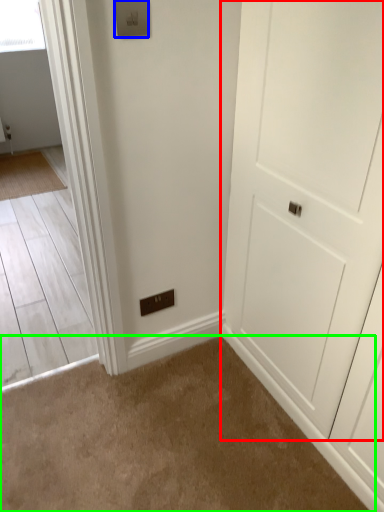
Question: Considering the real-world distances, which object is farthest from door (highlighted by a red box)? light switch (highlighted by a blue box) or plain (highlighted by a green box)?

Choices:
 (A) light switch
 (B) plain

Answer: (A)